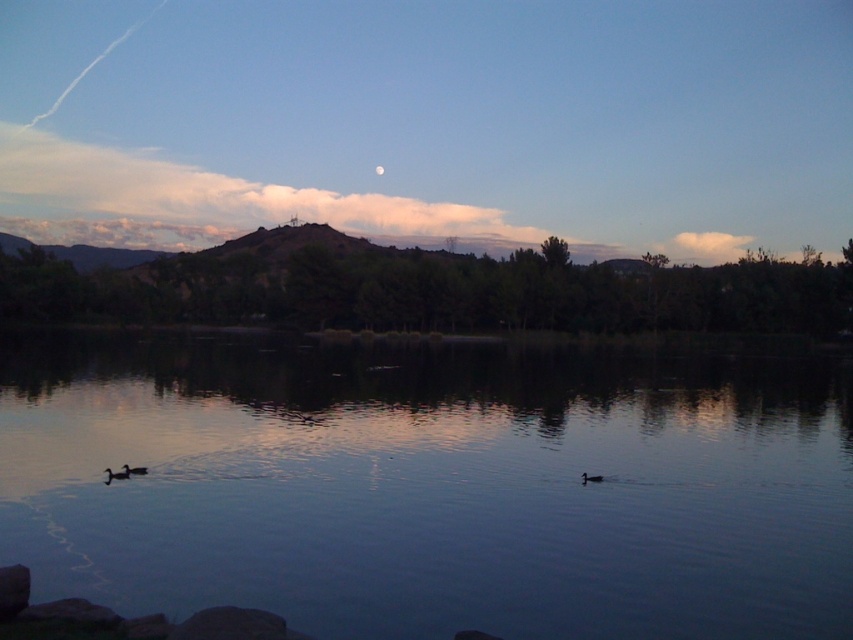
You are standing at the lakeside and want to know if the clear water at center is higher or lower than the dark brown duck at lower left. Based on the scene, what can you observe?

The clear water at center is taller than the dark brown duck at lower left, so the water is higher than the duck.

You are standing on the lakeside and want to observe the ducks swimming. Which object, the clear water at center or the matte black duck at center, is wider in this scene?

The clear water at center is wider than the matte black duck at center according to the description.